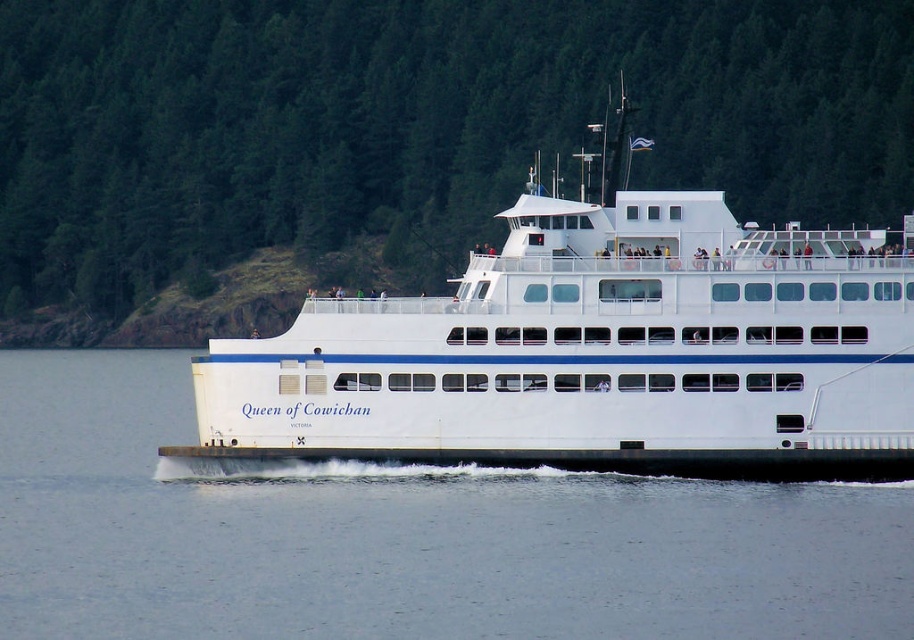
Question: Which point is closer to the camera?

Choices:
 (A) (288, 10)
 (B) (199, 372)
 (C) (370, 625)

Answer: (C)

Question: Is green textured trees at upper center in front of white water at center?

Choices:
 (A) yes
 (B) no

Answer: (B)

Question: Among these objects, which one is nearest to the camera?

Choices:
 (A) white smooth ferry at center
 (B) white water at center

Answer: (B)

Question: Is green textured trees at upper center wider than white smooth ferry at center?

Choices:
 (A) no
 (B) yes

Answer: (B)

Question: Which is farther from the green textured trees at upper center?

Choices:
 (A) white water at center
 (B) white smooth ferry at center

Answer: (A)

Question: Is green textured trees at upper center further to the viewer compared to white smooth ferry at center?

Choices:
 (A) no
 (B) yes

Answer: (B)